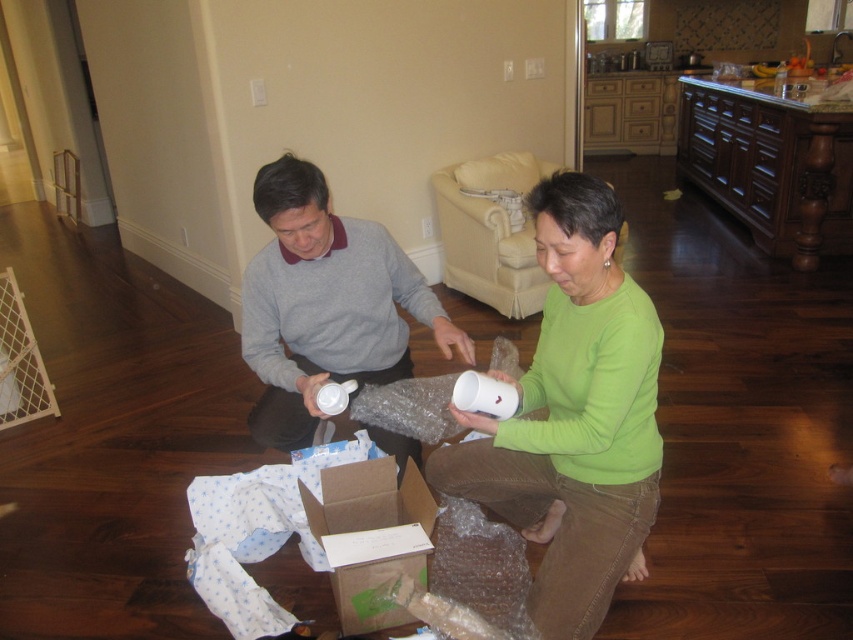
Question: Which point is closer to the camera taking this photo?

Choices:
 (A) (305, 499)
 (B) (579, 234)

Answer: (B)

Question: Does green matte/matte cup at center appear on the right side of brown cardboard box at center?

Choices:
 (A) yes
 (B) no

Answer: (A)

Question: Is green matte/matte cup at center below brown cardboard box at center?

Choices:
 (A) yes
 (B) no

Answer: (B)

Question: Which point is farther from the camera taking this photo?

Choices:
 (A) (582, 288)
 (B) (334, 481)
 (C) (314, 173)

Answer: (B)

Question: Which object is farther from the camera taking this photo?

Choices:
 (A) gray matte sweater at center
 (B) green matte/matte cup at center

Answer: (A)

Question: Can you confirm if green matte/matte cup at center is positioned to the left of gray matte sweater at center?

Choices:
 (A) no
 (B) yes

Answer: (A)